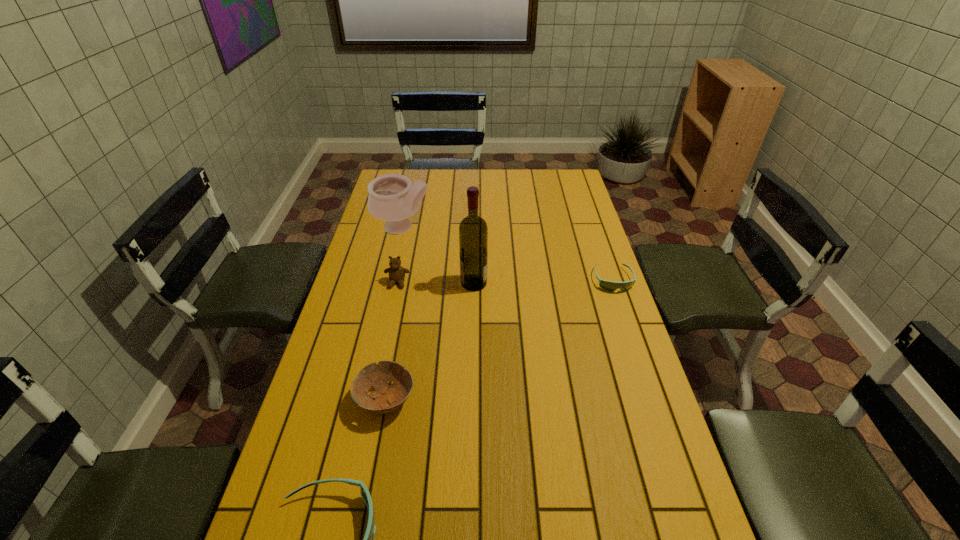
Locate an element on the screen. The height and width of the screenshot is (540, 960). vacant space that's between the second tallest object and the bowl is located at coordinates (394, 314).

Identify the location of vacant point located between the farthest object and the alcohol. The height and width of the screenshot is (540, 960). (438, 255).

What are the coordinates of `unoccupied area between the farthest object and the farther goggles` in the screenshot? It's located at (508, 254).

Identify the location of empty space that is in between the pottery and the third tallest object. point(399,255).

The image size is (960, 540). In order to click on free space between the farthest object and the third tallest object in this screenshot , I will do (x=399, y=255).

This screenshot has height=540, width=960. I want to click on vacant space that is in between the farthest object and the fourth shortest object, so click(399, 255).

Where is `vacant area that lies between the third tallest object and the farthest object`? vacant area that lies between the third tallest object and the farthest object is located at coordinates (399, 255).

Locate an element on the screen. The height and width of the screenshot is (540, 960). free space that is in between the second nearest object and the tallest object is located at coordinates (430, 341).

Identify which object is the fourth nearest to the teddy bear. Please provide its 2D coordinates. Your answer should be formatted as a tuple, i.e. [(x, y)], where the tuple contains the x and y coordinates of a point satisfying the conditions above.

[(611, 286)]

Identify which object is located as the third nearest to the pottery. Please provide its 2D coordinates. Your answer should be formatted as a tuple, i.e. [(x, y)], where the tuple contains the x and y coordinates of a point satisfying the conditions above.

[(611, 286)]